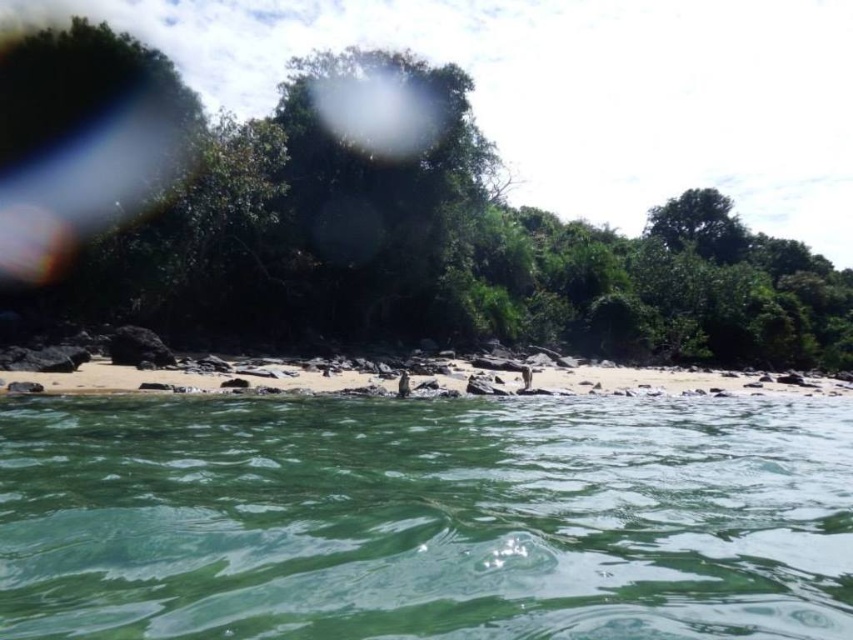
Question: Can you confirm if green leafy tree at center is positioned above white sand beach at center?

Choices:
 (A) yes
 (B) no

Answer: (A)

Question: Among these objects, which one is farthest from the camera?

Choices:
 (A) green leafy tree at center
 (B) white sand beach at center

Answer: (A)

Question: Does green leafy tree at center appear under white sand beach at center?

Choices:
 (A) no
 (B) yes

Answer: (A)

Question: Can you confirm if green translucent water at center is positioned below green leafy tree at center?

Choices:
 (A) no
 (B) yes

Answer: (B)

Question: Considering the real-world distances, which object is closest to the green translucent water at center?

Choices:
 (A) white sand beach at center
 (B) green leafy tree at center

Answer: (A)

Question: Which point is farther to the camera?

Choices:
 (A) green translucent water at center
 (B) white sand beach at center

Answer: (B)